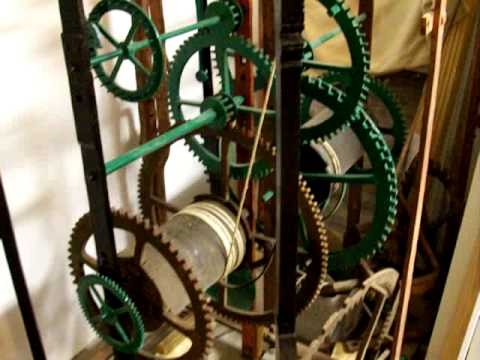
Locate an element on the screen. This screenshot has height=360, width=480. empty space on wall is located at coordinates (19, 79).